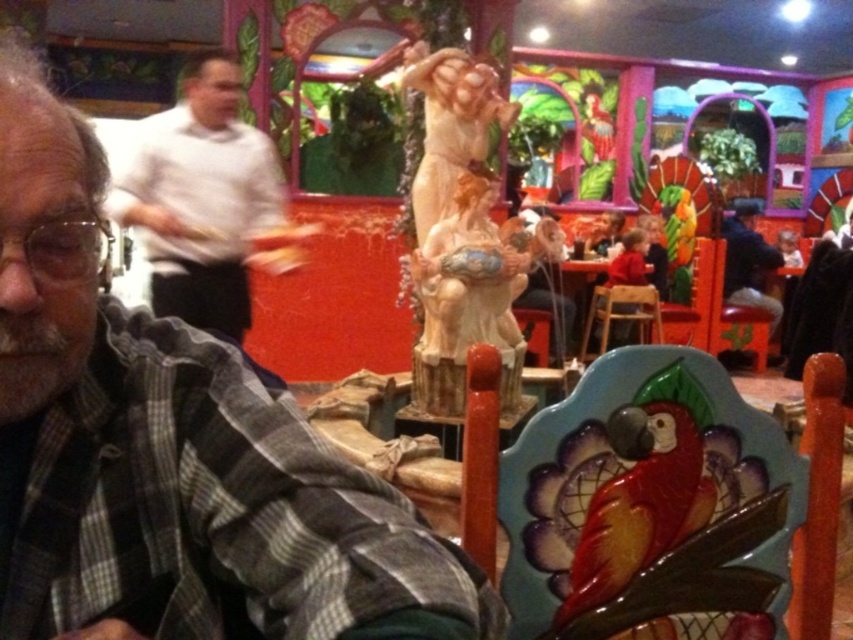
Question: Estimate the real-world distances between objects in this image. Which object is closer to the plaid shirt at center?

Choices:
 (A) white shirt at upper left
 (B) matte ceramic statue at center

Answer: (B)

Question: Which object appears farthest from the camera in this image?

Choices:
 (A) white shirt at upper left
 (B) matte ceramic statue at center
 (C) plaid shirt at center

Answer: (A)

Question: Among these points, which one is farthest from the camera?

Choices:
 (A) (238, 364)
 (B) (521, 352)

Answer: (B)

Question: Is plaid shirt at center wider than white shirt at upper left?

Choices:
 (A) no
 (B) yes

Answer: (A)

Question: Is the position of white shirt at upper left less distant than that of matte ceramic statue at center?

Choices:
 (A) yes
 (B) no

Answer: (B)

Question: Is white shirt at upper left further to the viewer compared to matte ceramic statue at center?

Choices:
 (A) no
 (B) yes

Answer: (B)